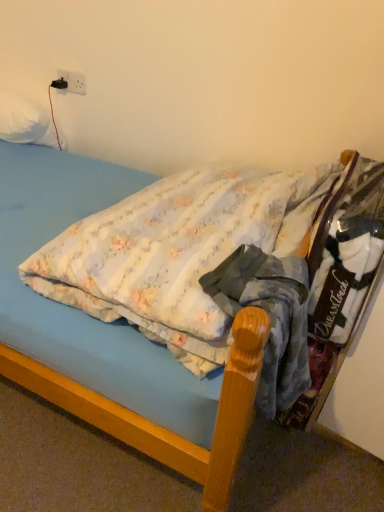
Question: Considering the relative sizes of white plastic electric outlet at upper left and white soft pillow at upper left in the image provided, is white plastic electric outlet at upper left wider than white soft pillow at upper left?

Choices:
 (A) no
 (B) yes

Answer: (A)

Question: From a real-world perspective, is white plastic electric outlet at upper left on white soft pillow at upper left?

Choices:
 (A) no
 (B) yes

Answer: (B)

Question: Considering the relative positions of white plastic electric outlet at upper left and white soft pillow at upper left in the image provided, is white plastic electric outlet at upper left to the right of white soft pillow at upper left from the viewer's perspective?

Choices:
 (A) no
 (B) yes

Answer: (B)

Question: Is white plastic electric outlet at upper left closer to the viewer compared to white soft pillow at upper left?

Choices:
 (A) yes
 (B) no

Answer: (B)

Question: Can white soft pillow at upper left be found inside white plastic electric outlet at upper left?

Choices:
 (A) yes
 (B) no

Answer: (B)

Question: Would you say white plastic electric outlet at upper left is a long distance from white soft pillow at upper left?

Choices:
 (A) yes
 (B) no

Answer: (B)

Question: Can you confirm if fluffy cotton bed at center is thinner than blue cotton shirt at center?

Choices:
 (A) yes
 (B) no

Answer: (B)

Question: Is fluffy cotton bed at center positioned with its back to blue cotton shirt at center?

Choices:
 (A) no
 (B) yes

Answer: (A)

Question: From the image's perspective, would you say fluffy cotton bed at center is shown under blue cotton shirt at center?

Choices:
 (A) no
 (B) yes

Answer: (A)

Question: Can you confirm if fluffy cotton bed at center is wider than blue cotton shirt at center?

Choices:
 (A) yes
 (B) no

Answer: (A)

Question: Is fluffy cotton bed at center to the right of blue cotton shirt at center from the viewer's perspective?

Choices:
 (A) yes
 (B) no

Answer: (B)

Question: Does fluffy cotton bed at center have a larger size compared to blue cotton shirt at center?

Choices:
 (A) no
 (B) yes

Answer: (B)

Question: Are fluffy cotton bed at center and white plastic electric outlet at upper left making contact?

Choices:
 (A) yes
 (B) no

Answer: (B)